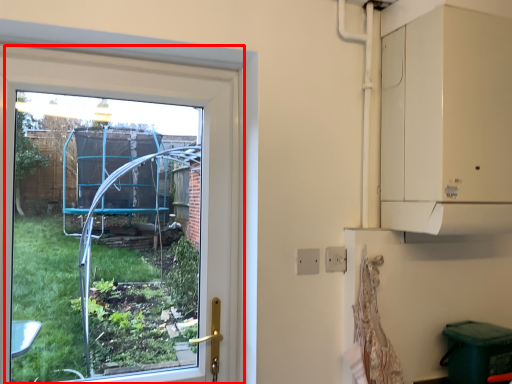
Question: In this image, where is window (annotated by the red box) located relative to electric outlet?

Choices:
 (A) left
 (B) right

Answer: (A)